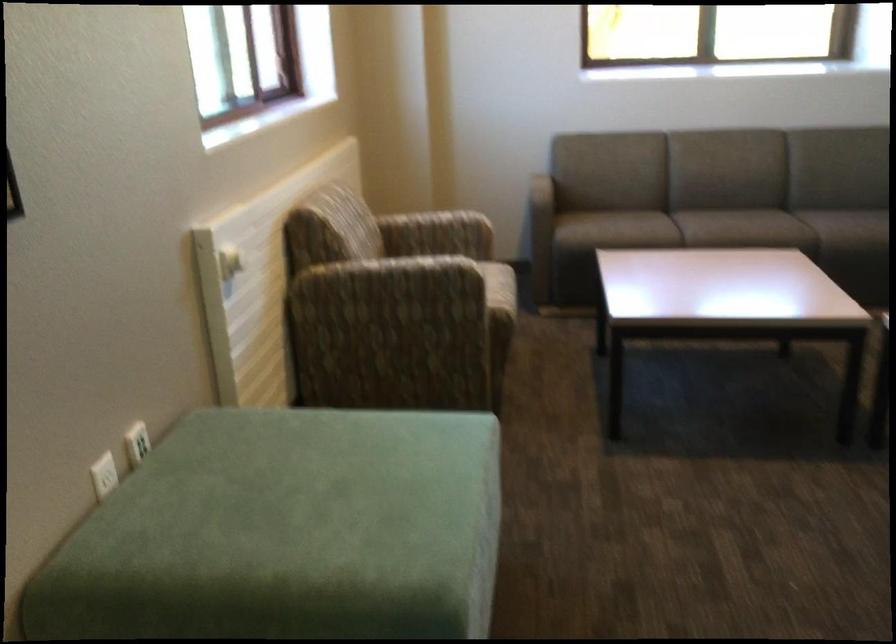
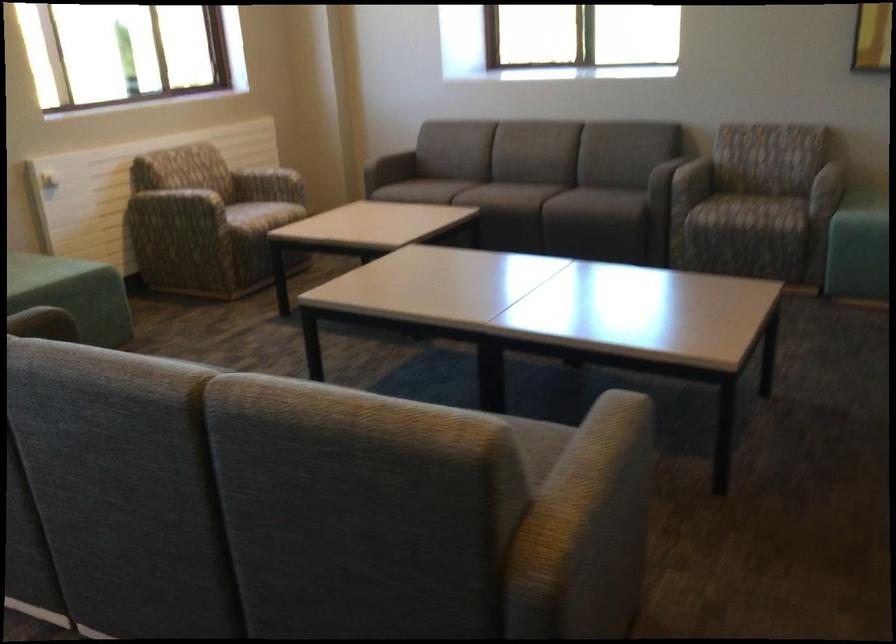
The point at (425,275) is marked in the first image. Where is the corresponding point in the second image?

(179, 204)